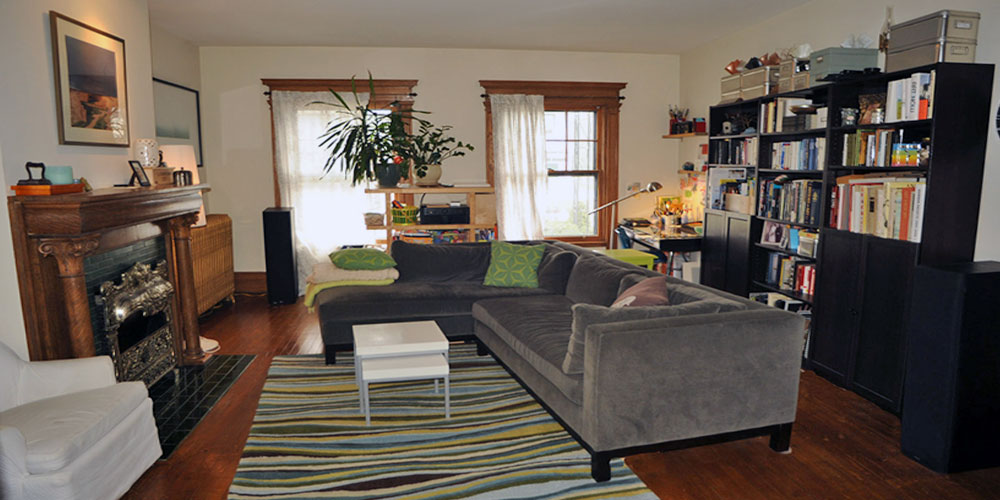
The height and width of the screenshot is (500, 1000). Identify the location of fireplace. (147, 325).